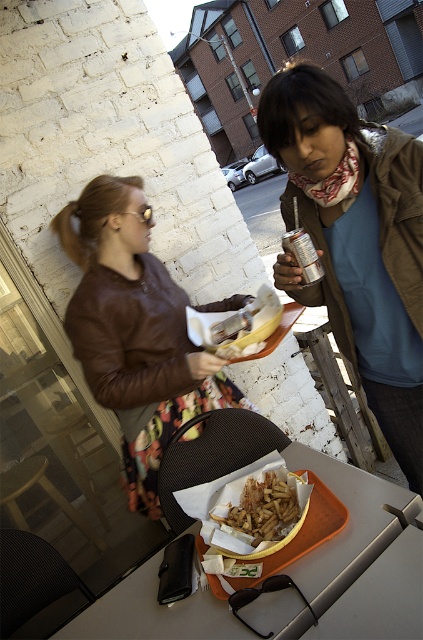
Does matte brown leather jacket at center have a smaller size compared to golden crispy fries at center?

No.

Image resolution: width=423 pixels, height=640 pixels. What are the coordinates of `matte brown leather jacket at center` in the screenshot? It's located at (356, 241).

Between point (373, 300) and point (294, 512), which one is positioned in front?

Point (294, 512) is more forward.

The image size is (423, 640). What are the coordinates of `matte brown leather jacket at center` in the screenshot? It's located at (356, 241).

Does matte brown leather jacket at center have a larger size compared to brown leather jacket at upper left?

No.

Can you confirm if matte brown leather jacket at center is smaller than brown leather jacket at upper left?

Indeed, matte brown leather jacket at center has a smaller size compared to brown leather jacket at upper left.

Is point (353, 189) positioned behind point (112, 266)?

No, (353, 189) is in front of (112, 266).

Where is `matte brown leather jacket at center`? The width and height of the screenshot is (423, 640). matte brown leather jacket at center is located at coordinates (356, 241).

Is matte brown leather jacket at center above orange tray at center?

Indeed, matte brown leather jacket at center is positioned over orange tray at center.

Consider the image. Between matte brown leather jacket at center and orange tray at center, which one appears on the left side from the viewer's perspective?

Positioned to the left is orange tray at center.

Is point (345, 188) farther from viewer compared to point (318, 582)?

Yes, point (345, 188) is farther from viewer.

I want to click on matte brown leather jacket at center, so click(356, 241).